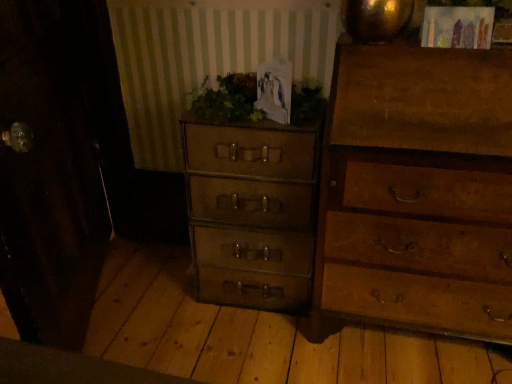
Question: Is green leafy plant at center taller or shorter than wooden chest of drawers at right, acting as the 1th chest of drawers starting from the right?

Choices:
 (A) short
 (B) tall

Answer: (A)

Question: From a real-world perspective, is green leafy plant at center physically located above or below wooden chest of drawers at right, acting as the 1th chest of drawers starting from the right?

Choices:
 (A) below
 (B) above

Answer: (B)

Question: Estimate the real-world distances between objects in this image. Which object is farther from the matte brown suitcase at center, which is the 1th chest of drawers from left to right?

Choices:
 (A) wooden chest of drawers at right, acting as the 1th chest of drawers starting from the right
 (B) green leafy plant at center

Answer: (A)

Question: Which of these objects is positioned farthest from the green leafy plant at center?

Choices:
 (A) wooden chest of drawers at right, acting as the 1th chest of drawers starting from the right
 (B) matte brown suitcase at center, the 2th chest of drawers from the right

Answer: (A)